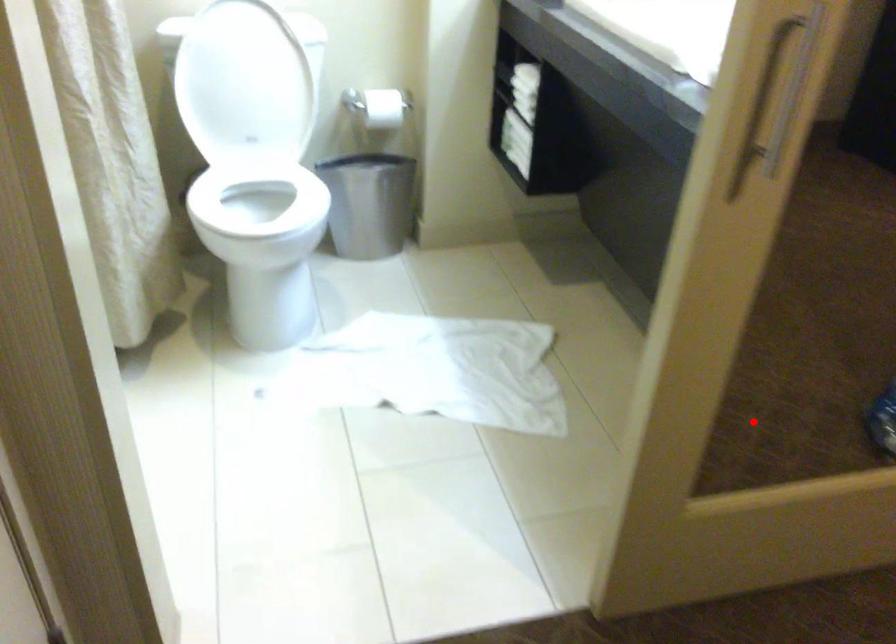
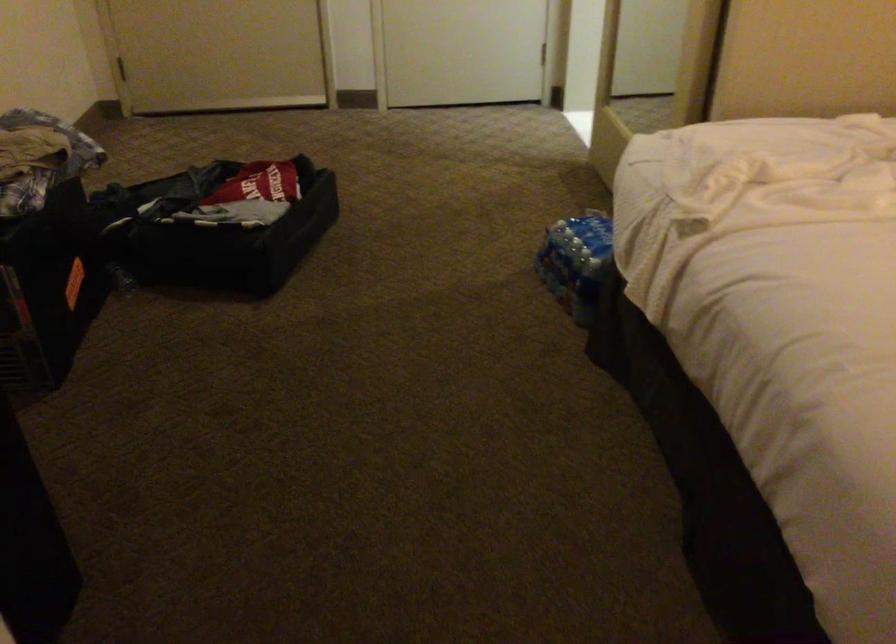
Question: I am providing you with two images of the same scene from different viewpoints. A red point is marked on the first image. At the location where the point appears in image 1, is it still visible in image 2?

Choices:
 (A) Yes
 (B) No

Answer: (B)